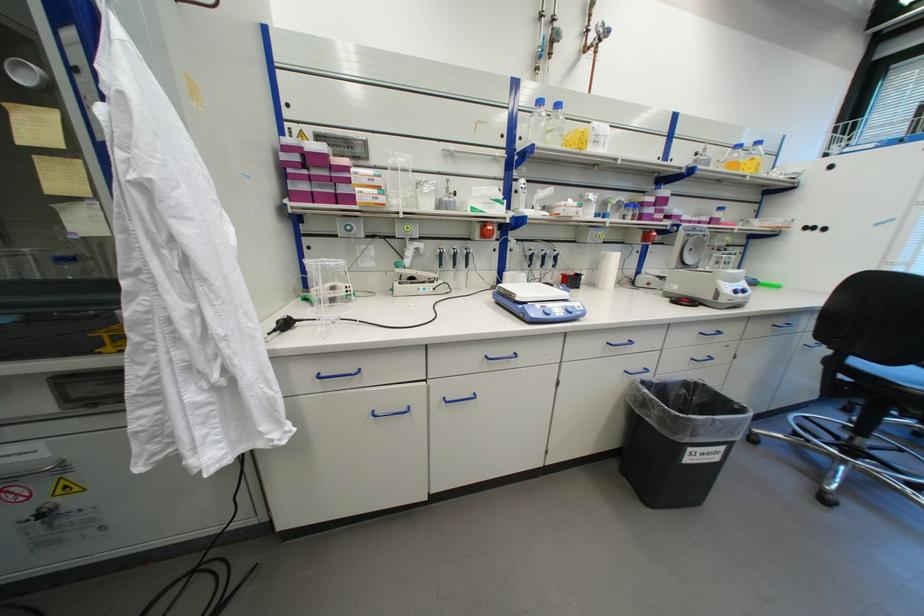
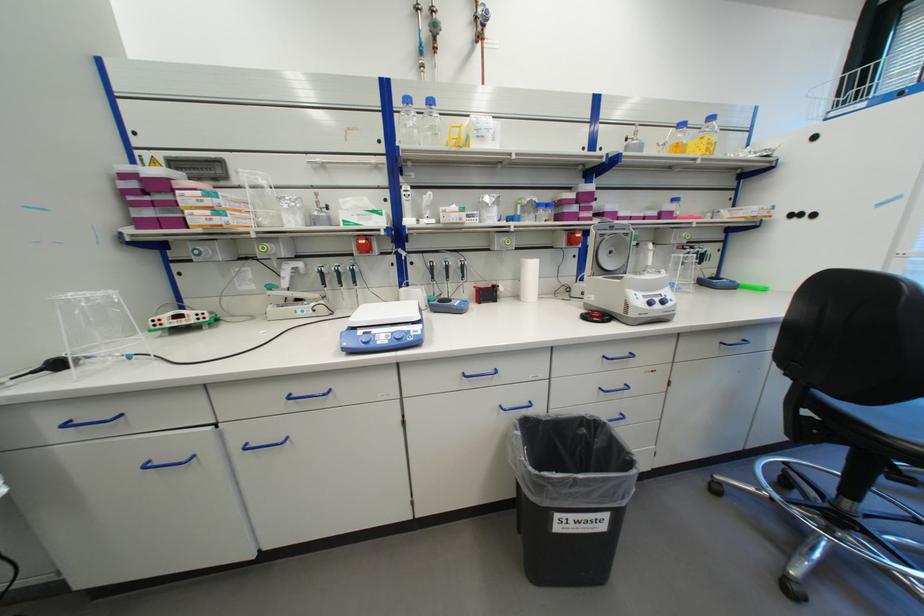
Question: The images are taken continuously from a first-person perspective. In which direction are you moving?

Choices:
 (A) Left
 (B) Right
 (C) Forward
 (D) Backward

Answer: (B)